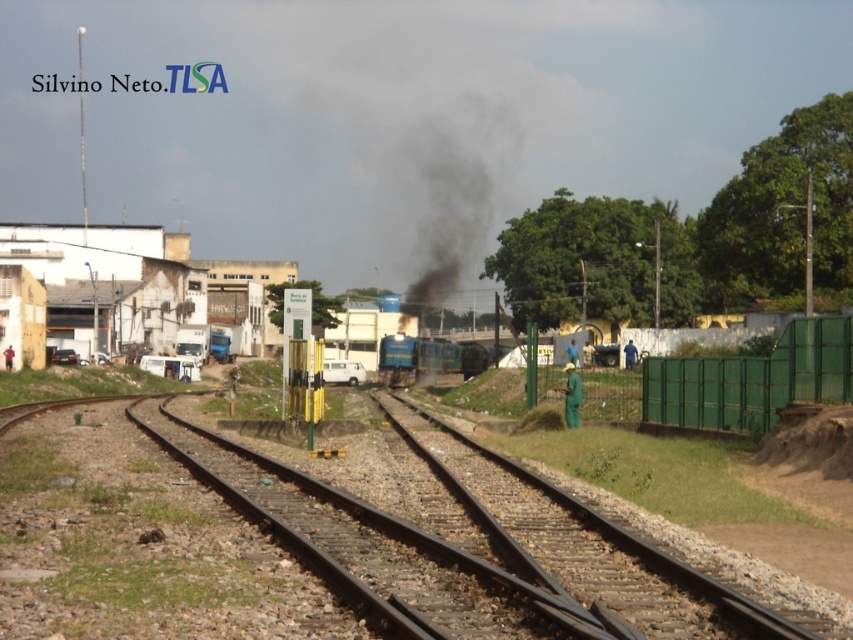
Question: From the image, what is the correct spatial relationship of metal train tracks at center in relation to blue metallic train at center?

Choices:
 (A) right
 (B) left

Answer: (B)

Question: Which point is closer to the camera?

Choices:
 (A) (405, 358)
 (B) (497, 461)
 (C) (477, 628)

Answer: (C)

Question: Does metal train tracks at center have a larger size compared to brown gravel train track at center?

Choices:
 (A) yes
 (B) no

Answer: (A)

Question: Where is brown gravel train track at center located in relation to blue metallic train at center in the image?

Choices:
 (A) left
 (B) right

Answer: (A)

Question: Which of the following is the farthest from the observer?

Choices:
 (A) (485, 360)
 (B) (210, 433)

Answer: (A)

Question: Which of the following is the farthest from the observer?

Choices:
 (A) metal train tracks at center
 (B) blue metallic train at center
 (C) brown gravel train track at center

Answer: (B)